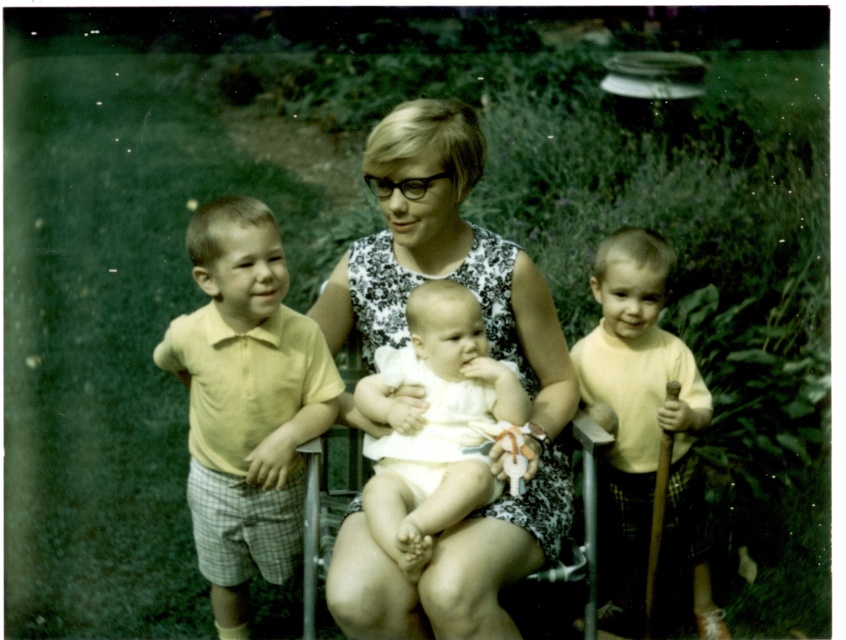
Question: Considering the real-world distances, which object is farthest from the white floral dress at center?

Choices:
 (A) yellow cotton shirt at left
 (B) white cloth baby at center

Answer: (A)

Question: Which of these objects is positioned closest to the white cloth baby at center?

Choices:
 (A) white floral dress at center
 (B) yellow matte shirt at right

Answer: (A)

Question: Can you confirm if yellow cotton shirt at left is smaller than white cloth baby at center?

Choices:
 (A) no
 (B) yes

Answer: (A)

Question: Which is farther from the yellow cotton shirt at left?

Choices:
 (A) white cloth baby at center
 (B) white floral dress at center

Answer: (B)

Question: Where is white floral dress at center located in relation to yellow cotton shirt at left in the image?

Choices:
 (A) left
 (B) right

Answer: (B)

Question: Is white floral dress at center thinner than yellow matte shirt at right?

Choices:
 (A) yes
 (B) no

Answer: (B)